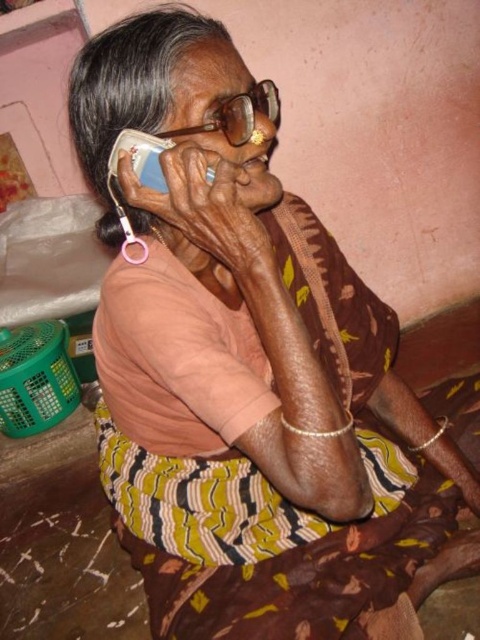
Based on the photo, who is more forward, [251,109] or [148,156]?

Point [251,109] is in front.

Who is more distant from viewer, (252,97) or (157,170)?

The point (252,97) is behind.

Who is more forward, [195,125] or [143,163]?

Point [195,125]

You are a GUI agent. You are given a task and a screenshot of the screen. Output one action in this format:
    pyautogui.click(x=<x>, y=<y>)
    Task: Click on the gold textured glasses at center
    
    Given the screenshot: What is the action you would take?
    pyautogui.click(x=237, y=115)